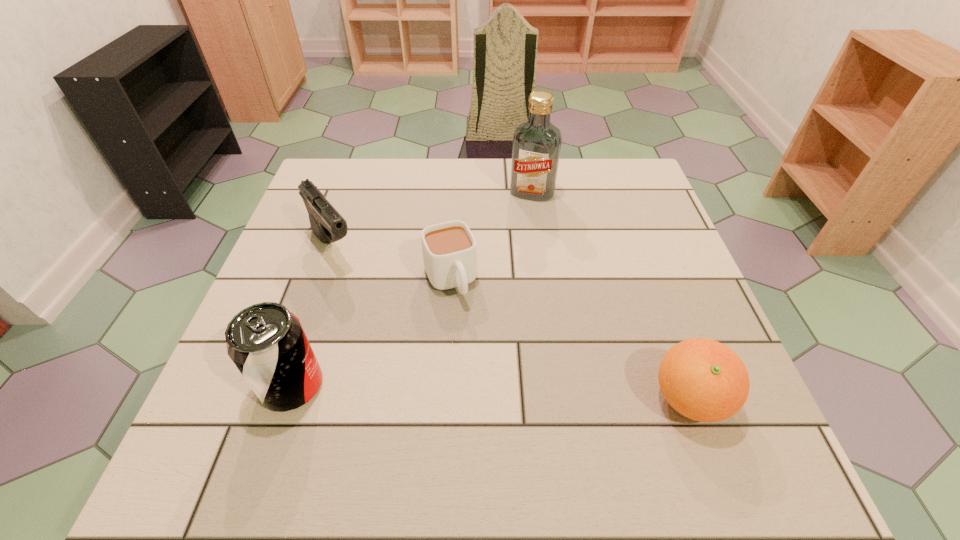
At what (x,y) coordinates should I click in order to perform the action: click on free region at the far right corner. Please return your answer as a coordinate pair (x, y). Looking at the image, I should click on (621, 168).

The width and height of the screenshot is (960, 540). I want to click on vacant point at the near right corner, so coord(676,415).

The image size is (960, 540). Identify the location of blank region between the second object from right to left and the shortest object. (492, 237).

Locate an element on the screen. The width and height of the screenshot is (960, 540). free point between the shortest object and the soda can is located at coordinates (372, 333).

The width and height of the screenshot is (960, 540). What are the coordinates of `free spot between the soda can and the rightmost object` in the screenshot? It's located at (491, 393).

At what (x,y) coordinates should I click in order to perform the action: click on free spot between the soda can and the pistol. Please return your answer as a coordinate pair (x, y). The image size is (960, 540). Looking at the image, I should click on (313, 317).

Locate an element on the screen. This screenshot has width=960, height=540. free area in between the soda can and the vodka is located at coordinates (412, 289).

At what (x,y) coordinates should I click in order to perform the action: click on vacant area that lies between the soda can and the pistol. Please return your answer as a coordinate pair (x, y). Image resolution: width=960 pixels, height=540 pixels. Looking at the image, I should click on (313, 317).

What are the coordinates of `vacant area that lies between the cup and the second shortest object` in the screenshot? It's located at (569, 340).

Find the location of a particular element. The width and height of the screenshot is (960, 540). unoccupied position between the third object from left to right and the soda can is located at coordinates (372, 333).